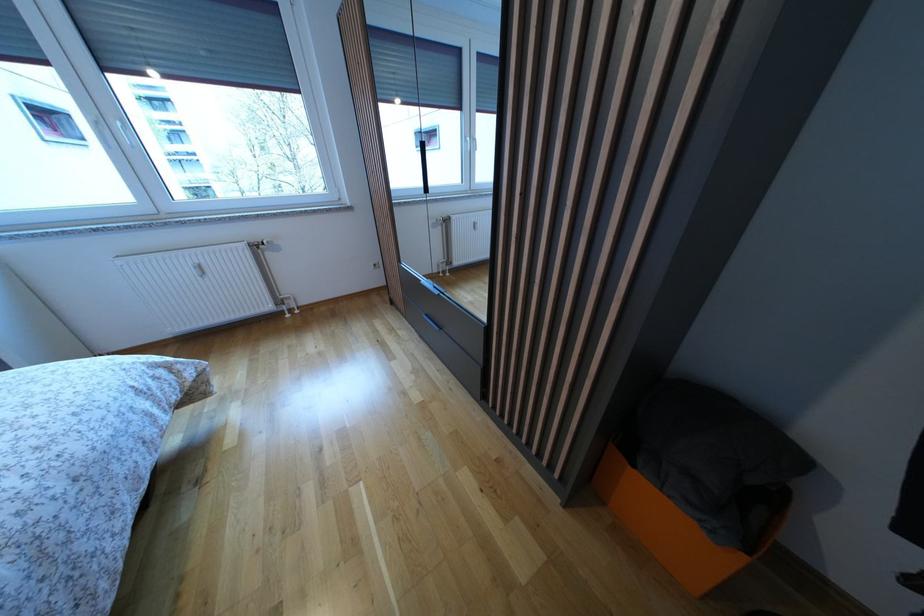
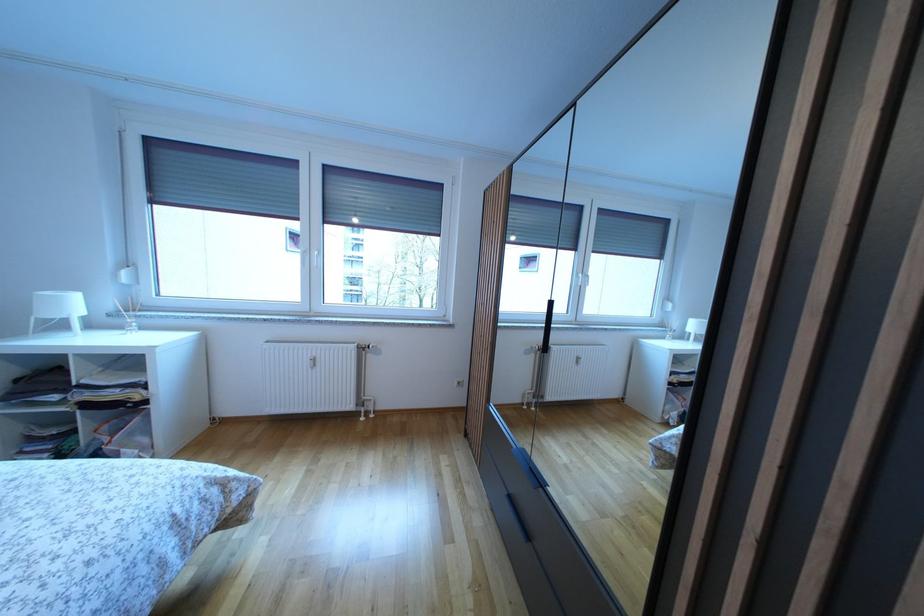
Locate, in the second image, the point that corresponds to the point at 200,278 in the first image.

(314, 370)